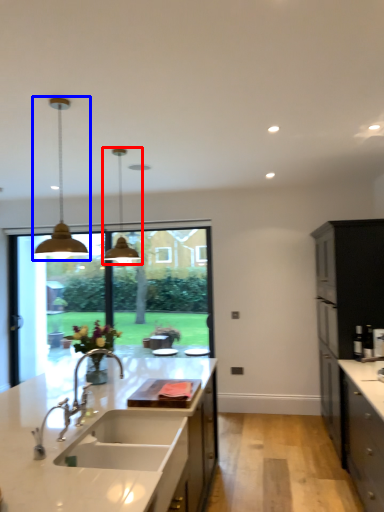
Question: Which of the following is the farthest to the observer, light fixture (highlighted by a red box) or lamp (highlighted by a blue box)?

Choices:
 (A) light fixture
 (B) lamp

Answer: (A)